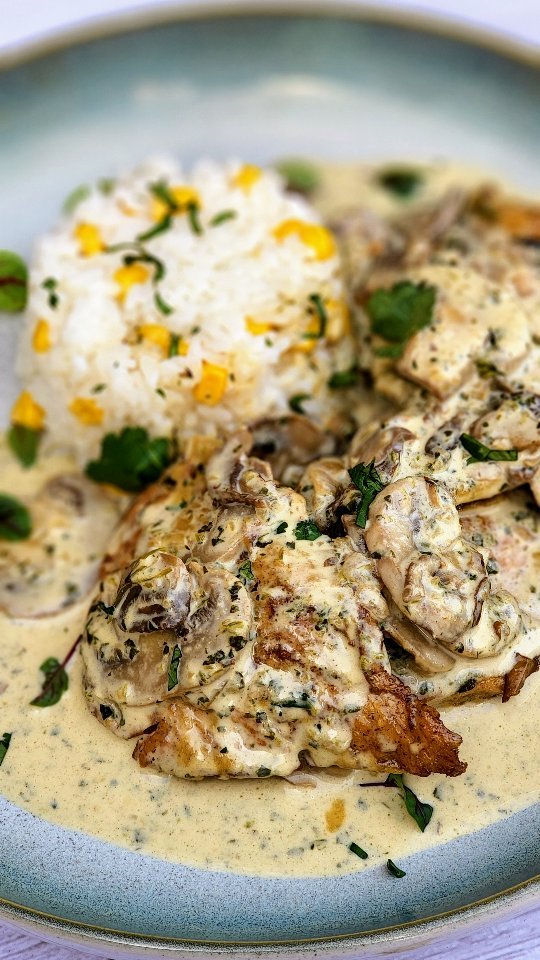
I want to click on table, so click(518, 946), click(27, 13), click(519, 17), click(16, 948).